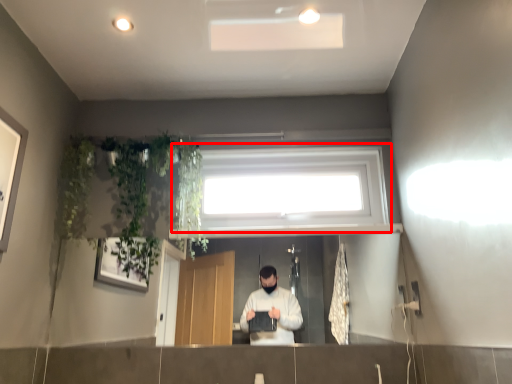
Question: From the image's perspective, what is the correct spatial relationship of window (annotated by the red box) in relation to plant?

Choices:
 (A) above
 (B) below

Answer: (A)